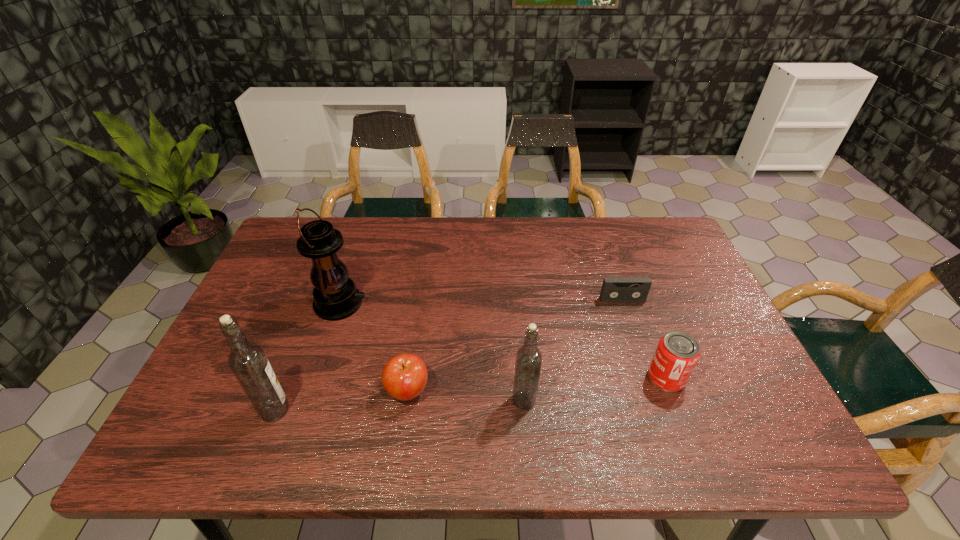
At what (x,y) coordinates should I click in order to perform the action: click on the taller vodka. Please return your answer as a coordinate pair (x, y). Looking at the image, I should click on (247, 360).

This screenshot has height=540, width=960. What are the coordinates of `the shorter vodka` in the screenshot? It's located at (528, 362).

The height and width of the screenshot is (540, 960). I want to click on the fourth shortest object, so click(528, 362).

The image size is (960, 540). What are the coordinates of `lantern` in the screenshot? It's located at (335, 296).

Where is `the shortest object`? the shortest object is located at coordinates (614, 289).

What are the coordinates of `the fourth tallest object` in the screenshot? It's located at (677, 353).

Image resolution: width=960 pixels, height=540 pixels. What are the coordinates of `the fifth tallest object` in the screenshot? It's located at (404, 377).

Find the location of a particular element. The height and width of the screenshot is (540, 960). the fourth object from right to left is located at coordinates (404, 377).

Where is `free space located on the label of the taller vodka`? This screenshot has height=540, width=960. free space located on the label of the taller vodka is located at coordinates (406, 410).

Identify the location of free space located 0.240m on the label of the right vodka. This screenshot has height=540, width=960. click(x=642, y=400).